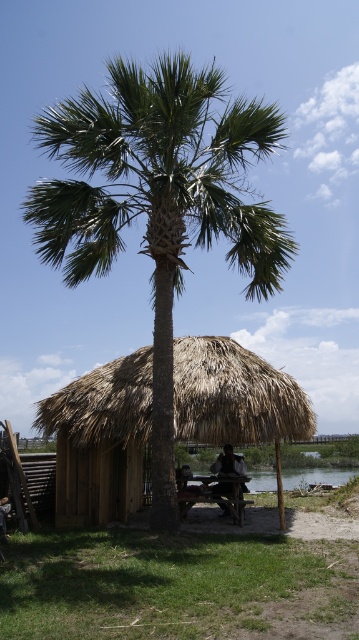
You are planning to set up a small tent between the green leafy palm tree at center and the wooden picnic table at center. Considering their widths, which object should you place the tent closer to to ensure it fits comfortably?

The wooden picnic table at center has a narrower width compared to the green leafy palm tree at center, so placing the tent closer to the wooden picnic table at center would allow it to fit more comfortably.

You are standing at the thatched wood hut at center and want to walk to the wooden picnic table at center. Which direction should you move to reach it?

The wooden picnic table at center is to the right of the thatched wood hut at center, so you should move to your right to reach it.

You are standing at the picnic table in front of the thatched wood hut. You want to walk to the point marked at coordinates (100, 440). Is this point located on the thatched wood hut at center?

Yes, the point marked at coordinates (100, 440) is located on the thatched wood hut at center according to the description.